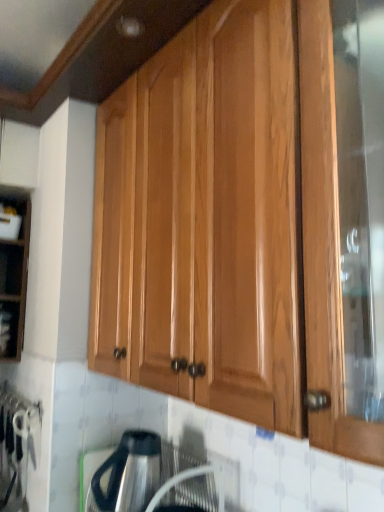
Question: Choose the correct answer: Is matte black shelf at left inside glossy wood cabinet at upper center or outside it?

Choices:
 (A) outside
 (B) inside

Answer: (A)

Question: Considering the positions of point (1, 340) and point (364, 7), is point (1, 340) closer or farther from the camera than point (364, 7)?

Choices:
 (A) farther
 (B) closer

Answer: (A)

Question: Which object is the farthest from the satin silver kettle at lower center?

Choices:
 (A) matte black shelf at left
 (B) glossy wood cabinet at upper center

Answer: (A)

Question: Which object is the closest to the matte black shelf at left?

Choices:
 (A) satin silver kettle at lower center
 (B) glossy wood cabinet at upper center

Answer: (A)